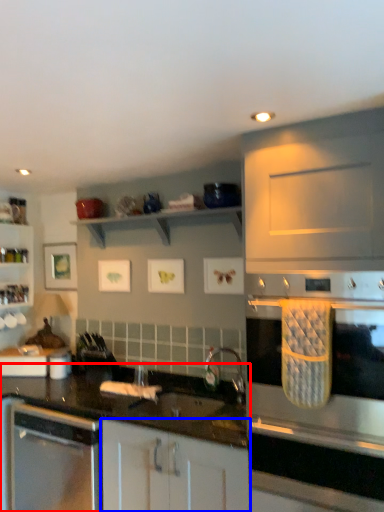
Question: Which point is closer to the camera, countertop (highlighted by a red box) or cabinetry (highlighted by a blue box)?

Choices:
 (A) countertop
 (B) cabinetry

Answer: (B)